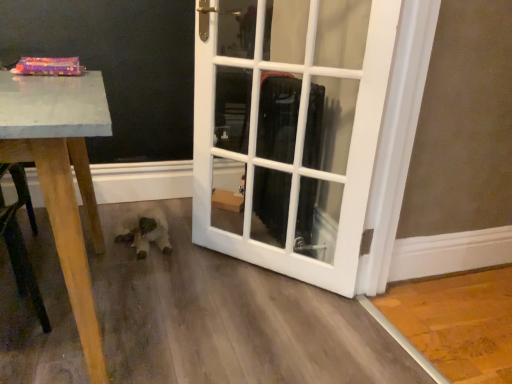
Where is `spots to the right of white plush toy at lower center`? This screenshot has height=384, width=512. spots to the right of white plush toy at lower center is located at coordinates (196, 240).